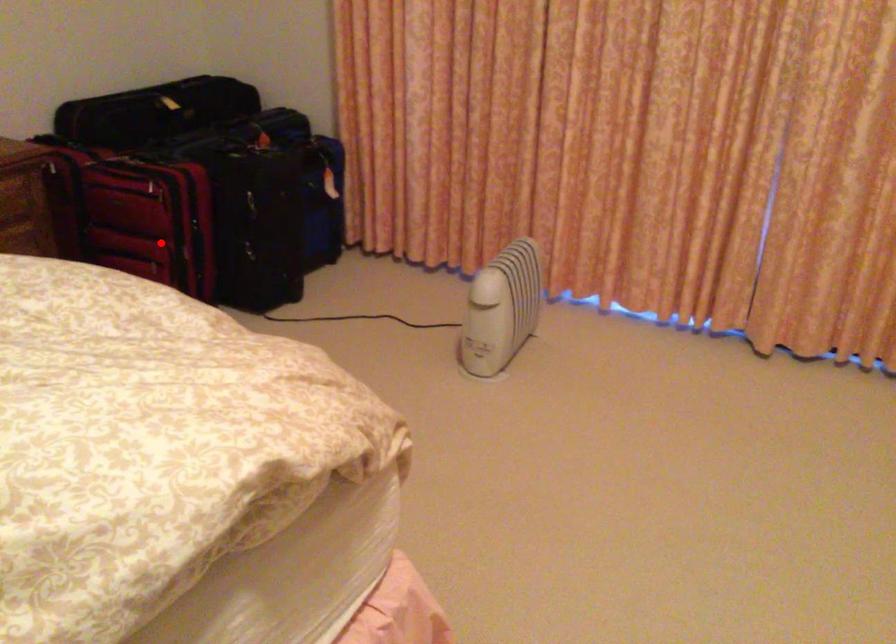
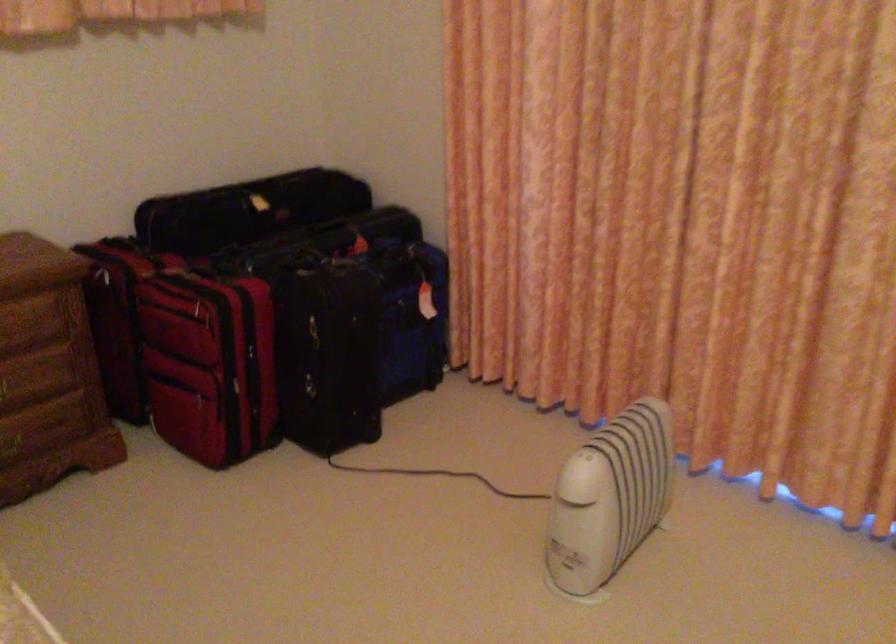
The point at the highlighted location is marked in the first image. Where is the corresponding point in the second image?

(209, 364)